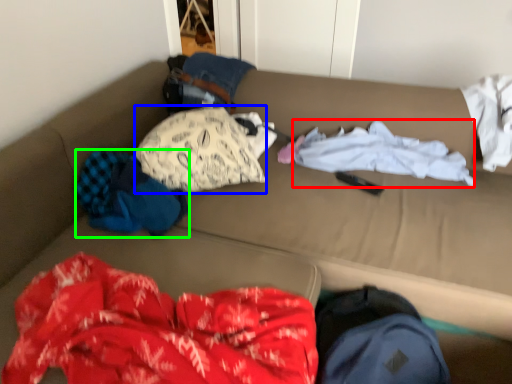
Question: Based on their relative distances, which object is farther from clothing (highlighted by a red box)? Choose from clothing (highlighted by a blue box) and clothing (highlighted by a green box).

Choices:
 (A) clothing
 (B) clothing

Answer: (B)